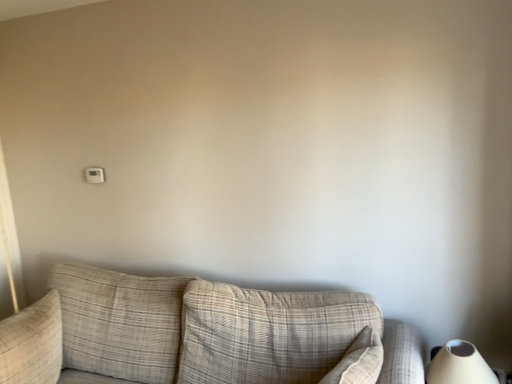
The width and height of the screenshot is (512, 384). Describe the element at coordinates (459, 365) in the screenshot. I see `white matte table lamp at lower right` at that location.

Measure the distance between point (103,180) and camera.

Point (103,180) and camera are 7.99 feet apart from each other.

Measure the distance between beige plaid couch at center and camera.

beige plaid couch at center and camera are 1.42 meters apart.

At what (x,y) coordinates should I click in order to perform the action: click on white matte table lamp at lower right. Please return your answer as a coordinate pair (x, y). The image size is (512, 384). Looking at the image, I should click on (459, 365).

Can you confirm if white matte table lamp at lower right is positioned to the left of beige textured pillow at left?

Incorrect, white matte table lamp at lower right is not on the left side of beige textured pillow at left.

Which is closer, (461,360) or (8,348)?

Point (461,360) is closer to the camera than point (8,348).

Considering the positions of objects white matte table lamp at lower right and beige textured pillow at left in the image provided, who is behind, white matte table lamp at lower right or beige textured pillow at left?

beige textured pillow at left is behind.

Which is further, [87,170] or [53,350]?

The point [87,170] is behind.

From the image's perspective, which one is positioned lower, white plastic thermostat at upper left or beige textured pillow at left?

beige textured pillow at left is shown below in the image.

Does white plastic thermostat at upper left come in front of beige textured pillow at left?

No, white plastic thermostat at upper left is behind beige textured pillow at left.

Does white plastic thermostat at upper left have a smaller size compared to beige textured pillow at left?

Indeed, white plastic thermostat at upper left has a smaller size compared to beige textured pillow at left.

From the image's perspective, between white matte table lamp at lower right and beige plaid couch at center, who is located below?

beige plaid couch at center appears lower in the image.

Considering the sizes of objects white matte table lamp at lower right and beige plaid couch at center in the image provided, who is bigger, white matte table lamp at lower right or beige plaid couch at center?

Bigger between the two is beige plaid couch at center.

Visually, is white matte table lamp at lower right positioned to the left or to the right of beige plaid couch at center?

In the image, white matte table lamp at lower right appears on the right side of beige plaid couch at center.

Looking at this image, would you say white plastic thermostat at upper left is to the left or to the right of white matte table lamp at lower right in the picture?

Clearly, white plastic thermostat at upper left is on the left of white matte table lamp at lower right in the image.

Image resolution: width=512 pixels, height=384 pixels. Identify the location of table lamp that appears below the white plastic thermostat at upper left (from a real-world perspective). (459, 365).

From the image's perspective, which is above, white plastic thermostat at upper left or white matte table lamp at lower right?

white plastic thermostat at upper left.

Considering the relative positions of beige textured pillow at left and white matte table lamp at lower right in the image provided, is beige textured pillow at left to the left or to the right of white matte table lamp at lower right?

beige textured pillow at left is positioned on white matte table lamp at lower right's left side.

Considering the sizes of beige textured pillow at left and white matte table lamp at lower right in the image, is beige textured pillow at left wider or thinner than white matte table lamp at lower right?

In the image, beige textured pillow at left appears to be wider than white matte table lamp at lower right.

From the image's perspective, relative to white matte table lamp at lower right, is beige textured pillow at left above or below?

beige textured pillow at left is situated lower than white matte table lamp at lower right in the image.

In the image, is beige textured pillow at left positioned in front of or behind white matte table lamp at lower right?

In the image, beige textured pillow at left appears behind white matte table lamp at lower right.

The width and height of the screenshot is (512, 384). What are the coordinates of `studio couch that appears on the right of white plastic thermostat at upper left` in the screenshot? It's located at (202, 334).

Is beige plaid couch at center wider or thinner than white plastic thermostat at upper left?

In the image, beige plaid couch at center appears to be wider than white plastic thermostat at upper left.

Which point is more distant from viewer, (429, 377) or (97, 172)?

The point (97, 172) is more distant.

Is white matte table lamp at lower right outside of white plastic thermostat at upper left?

Absolutely, white matte table lamp at lower right is external to white plastic thermostat at upper left.

From the picture: Considering the sizes of white matte table lamp at lower right and white plastic thermostat at upper left in the image, is white matte table lamp at lower right taller or shorter than white plastic thermostat at upper left?

Clearly, white matte table lamp at lower right is taller compared to white plastic thermostat at upper left.

From the picture: Considering the sizes of objects white matte table lamp at lower right and white plastic thermostat at upper left in the image provided, who is smaller, white matte table lamp at lower right or white plastic thermostat at upper left?

Smaller between the two is white plastic thermostat at upper left.

The width and height of the screenshot is (512, 384). What are the coordinates of `table lamp that is above the beige textured pillow at left (from the image's perspective)` in the screenshot? It's located at (459, 365).

Image resolution: width=512 pixels, height=384 pixels. I want to click on pillow that appears on the left of white plastic thermostat at upper left, so click(x=32, y=343).

Which object lies nearer to the anchor point white plastic thermostat at upper left, beige textured pillow at left or beige plaid couch at center?

beige textured pillow at left is closer to white plastic thermostat at upper left.

Which object lies further to the anchor point beige textured pillow at left, beige plaid couch at center or white plastic thermostat at upper left?

Based on the image, white plastic thermostat at upper left appears to be further to beige textured pillow at left.

Based on their spatial positions, is white plastic thermostat at upper left or white matte table lamp at lower right further from beige plaid couch at center?

Based on the image, white plastic thermostat at upper left appears to be further to beige plaid couch at center.

When comparing their distances from white plastic thermostat at upper left, does beige plaid couch at center or white matte table lamp at lower right seem closer?

Among the two, beige plaid couch at center is located nearer to white plastic thermostat at upper left.

Based on their spatial positions, is white plastic thermostat at upper left or beige textured pillow at left further from white matte table lamp at lower right?

white plastic thermostat at upper left is further to white matte table lamp at lower right.

Looking at the image, which one is located closer to white matte table lamp at lower right, beige plaid couch at center or white plastic thermostat at upper left?

The object closer to white matte table lamp at lower right is beige plaid couch at center.

When comparing their distances from white matte table lamp at lower right, does white plastic thermostat at upper left or beige plaid couch at center seem closer?

The object closer to white matte table lamp at lower right is beige plaid couch at center.

Based on their spatial positions, is beige textured pillow at left or white matte table lamp at lower right closer to beige plaid couch at center?

beige textured pillow at left lies closer to beige plaid couch at center than the other object.

Find the location of a particular element. This screenshot has width=512, height=384. studio couch between white plastic thermostat at upper left and white matte table lamp at lower right from left to right is located at coordinates pyautogui.click(x=202, y=334).

At what (x,y) coordinates should I click in order to perform the action: click on studio couch situated between beige textured pillow at left and white matte table lamp at lower right from left to right. Please return your answer as a coordinate pair (x, y). Image resolution: width=512 pixels, height=384 pixels. Looking at the image, I should click on (202, 334).

This screenshot has height=384, width=512. What are the coordinates of `light switch between beige textured pillow at left and white matte table lamp at lower right in the horizontal direction` in the screenshot? It's located at (94, 175).

This screenshot has height=384, width=512. I want to click on pillow between beige plaid couch at center and white plastic thermostat at upper left along the z-axis, so click(32, 343).